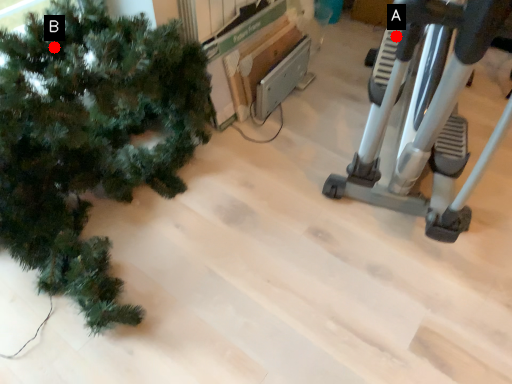
Question: Two points are circled on the image, labeled by A and B beside each circle. Among these points, which one is farthest from the camera?

Choices:
 (A) A is further
 (B) B is further

Answer: (A)